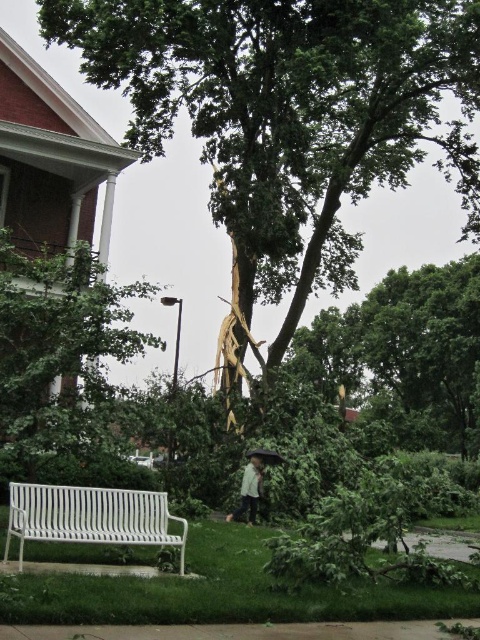
Question: Which object appears closest to the camera in this image?

Choices:
 (A) light green fabric umbrella at lower center
 (B) green leafy tree at left
 (C) white metal bench at lower left

Answer: (C)

Question: Does brown textured tree trunk at center have a greater width compared to white metal bench at lower left?

Choices:
 (A) yes
 (B) no

Answer: (A)

Question: Is green leafy tree at left smaller than light green fabric umbrella at lower center?

Choices:
 (A) yes
 (B) no

Answer: (B)

Question: Which object appears farthest from the camera in this image?

Choices:
 (A) white metal bench at lower left
 (B) light green fabric umbrella at lower center
 (C) brown textured tree trunk at center

Answer: (C)

Question: Does green leafy tree at left have a lesser width compared to black matte umbrella at center?

Choices:
 (A) yes
 (B) no

Answer: (B)

Question: Which object is farther from the camera taking this photo?

Choices:
 (A) light green fabric umbrella at lower center
 (B) green leafy tree at left
 (C) brown textured tree trunk at center

Answer: (C)